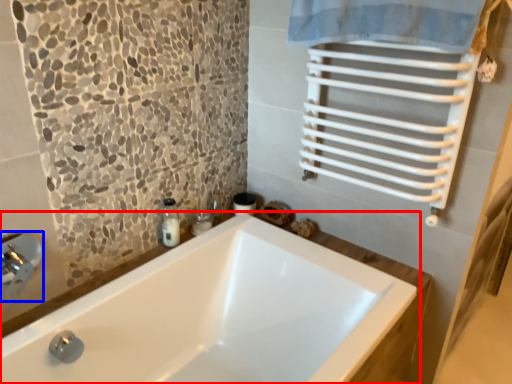
Question: Which of the following is the farthest to the observer, bathtub (highlighted by a red box) or faucet (highlighted by a blue box)?

Choices:
 (A) bathtub
 (B) faucet

Answer: (B)